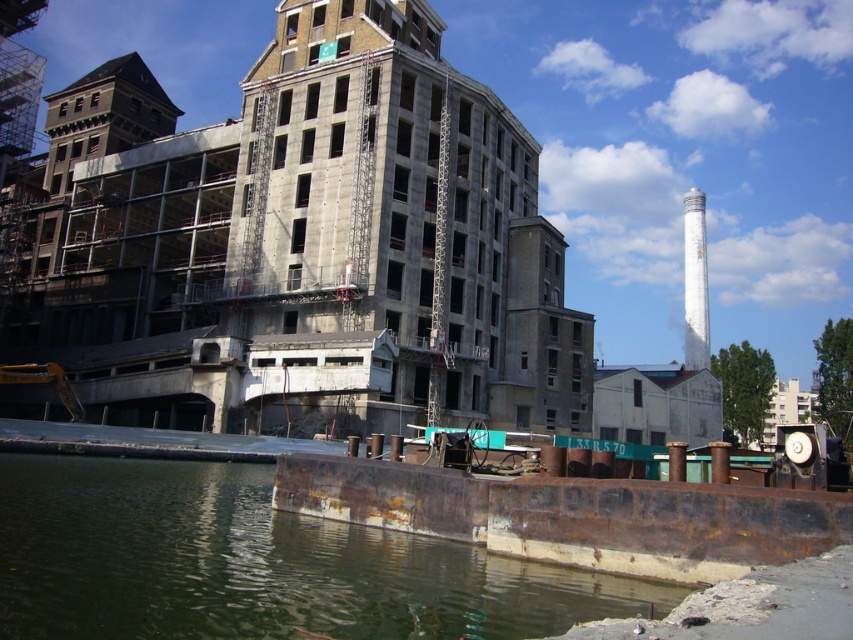
Identify the location of rusty metal river at lower left. This screenshot has width=853, height=640. (256, 564).

Is rusty metal river at lower left smaller than white painted concrete tower at upper right?

Yes, rusty metal river at lower left is smaller than white painted concrete tower at upper right.

Which is behind, point (496, 579) or point (686, 220)?

The point (686, 220) is behind.

You are a GUI agent. You are given a task and a screenshot of the screen. Output one action in this format:
    pyautogui.click(x=<x>, y=<y>)
    Task: Click on the rusty metal river at lower left
    The width and height of the screenshot is (853, 640).
    Given the screenshot: What is the action you would take?
    pyautogui.click(x=256, y=564)